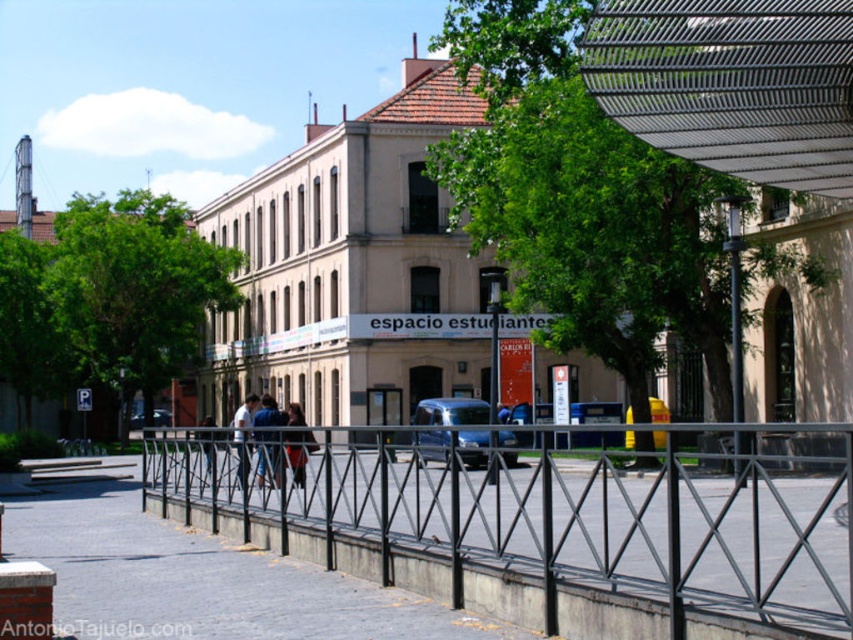
Is black metal fence at center to the right of blue denim jeans at center from the viewer's perspective?

Correct, you'll find black metal fence at center to the right of blue denim jeans at center.

The width and height of the screenshot is (853, 640). In order to click on black metal fence at center in this screenshot , I will do `click(567, 518)`.

Image resolution: width=853 pixels, height=640 pixels. What are the coordinates of `black metal fence at center` in the screenshot? It's located at (567, 518).

This screenshot has width=853, height=640. What do you see at coordinates (450, 412) in the screenshot? I see `blue metallic van at center` at bounding box center [450, 412].

Can you confirm if blue metallic van at center is wider than light blue jeans at center?

In fact, blue metallic van at center might be narrower than light blue jeans at center.

Does point (450, 438) come farther from viewer compared to point (248, 422)?

No, it is in front of (248, 422).

Where is `blue metallic van at center`? blue metallic van at center is located at coordinates (450, 412).

Is point (427, 401) farther from camera compared to point (212, 442)?

Yes, point (427, 401) is behind point (212, 442).

Is point (480, 464) positioned before point (212, 474)?

No, it is behind (212, 474).

Which is in front, point (474, 465) or point (212, 458)?

Positioned in front is point (212, 458).

Locate an element on the screen. blue metallic van at center is located at coordinates (450, 412).